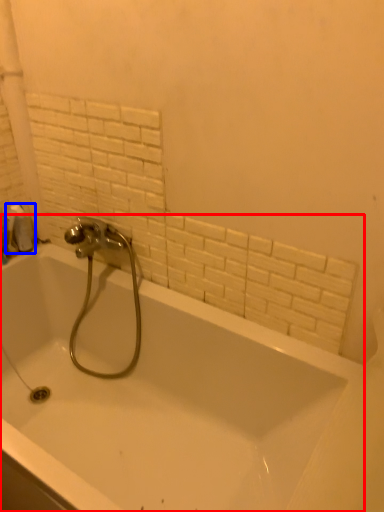
Question: Among these objects, which one is nearest to the camera, bathtub (highlighted by a red box) or toilet paper (highlighted by a blue box)?

Choices:
 (A) bathtub
 (B) toilet paper

Answer: (A)